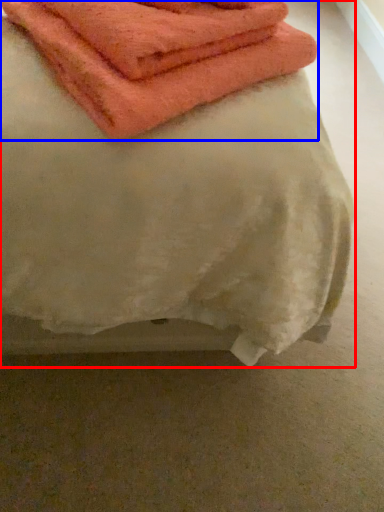
Question: Which point is further to the camera, towel (highlighted by a red box) or towel (highlighted by a blue box)?

Choices:
 (A) towel
 (B) towel

Answer: (B)